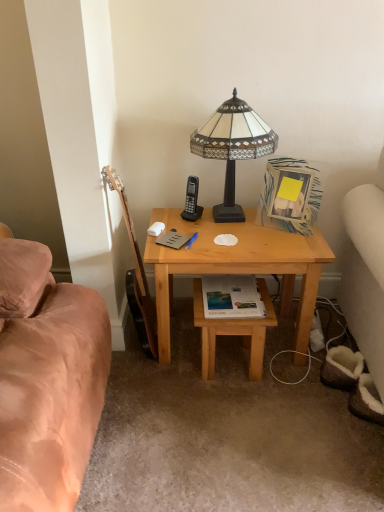
I want to click on free point in front of stained glass lampshade at upper center, so click(235, 244).